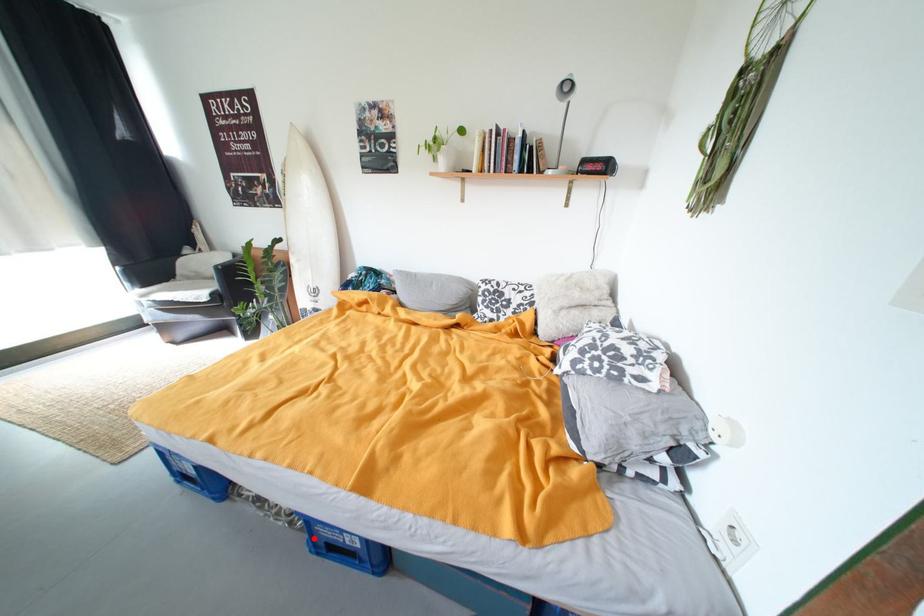
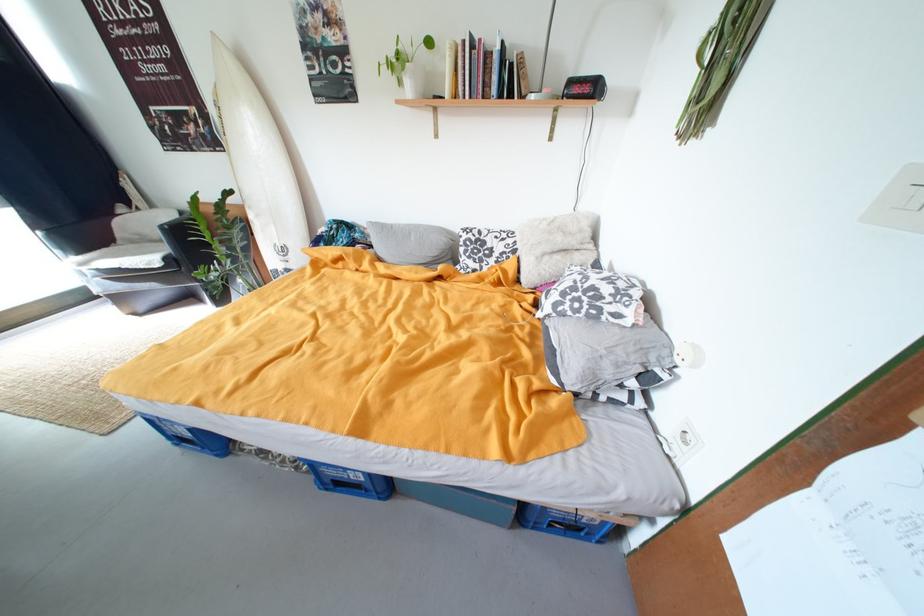
Question: I am providing you with two images of the same scene from different viewpoints. Given a red point in image1, look at the same physical point in image2. Is it:

Choices:
 (A) Closer to the viewpoint
 (B) Farther from the viewpoint

Answer: (B)